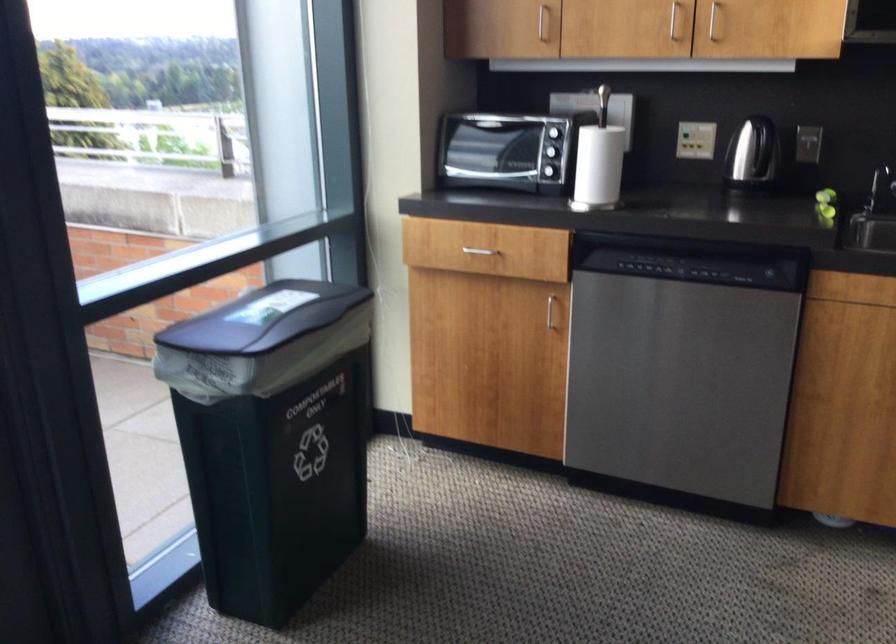
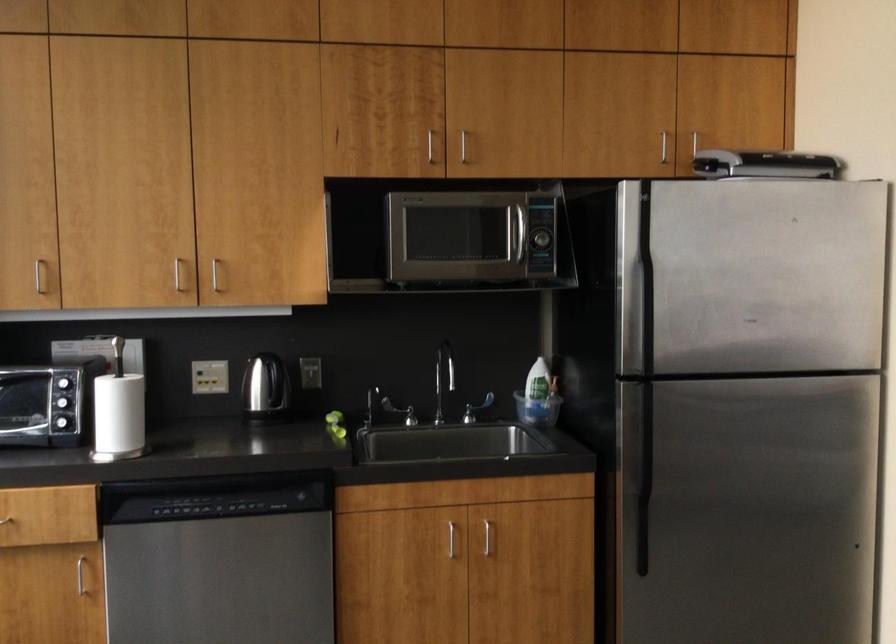
Locate, in the second image, the point that corresponds to (x=752, y=152) in the first image.

(266, 391)